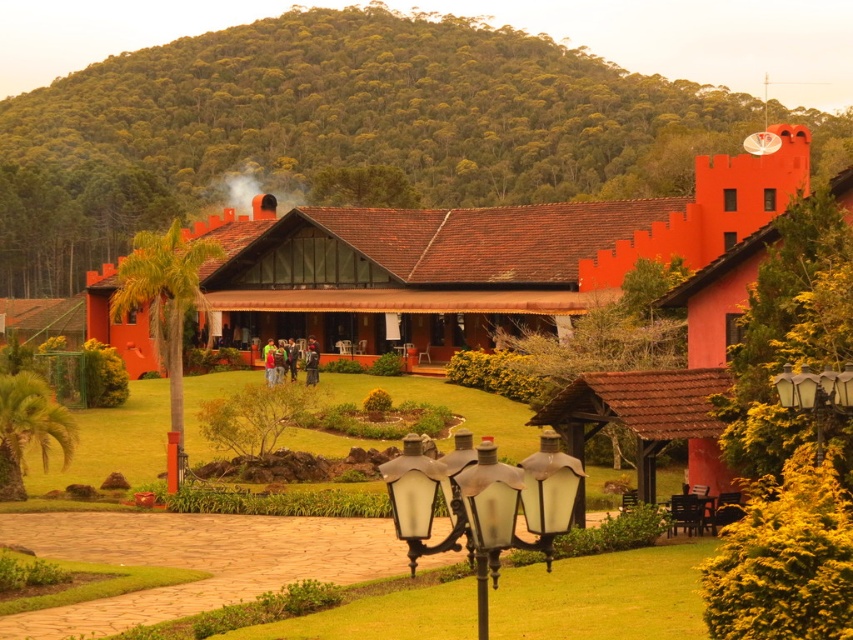
Can you confirm if green grass at center is thinner than matte glass lamp post at right?

Incorrect, green grass at center's width is not less than matte glass lamp post at right's.

Is green grass at center smaller than matte glass lamp post at right?

Answer: No.

You are a GUI agent. You are given a task and a screenshot of the screen. Output one action in this format:
    pyautogui.click(x=<x>, y=<y>)
    Task: Click on the green grass at center
    The width and height of the screenshot is (853, 640).
    Given the screenshot: What is the action you would take?
    pyautogui.click(x=113, y=442)

Between green leafy hillside at upper center and matte black lamp post at center, which one appears on the right side from the viewer's perspective?

Positioned to the right is matte black lamp post at center.

Is point (4, 172) closer to viewer compared to point (532, 531)?

That is False.

Between point (84, 160) and point (544, 532), which one is positioned in front?

Point (544, 532) is in front.

Where is `green leafy hillside at upper center`? The width and height of the screenshot is (853, 640). green leafy hillside at upper center is located at coordinates (335, 129).

Between green leafy hillside at upper center and matte glass lamp post at right, which one is positioned higher?

green leafy hillside at upper center is higher up.

Measure the distance from green leafy hillside at upper center to matte glass lamp post at right.

A distance of 152.93 meters exists between green leafy hillside at upper center and matte glass lamp post at right.

At what (x,y) coordinates should I click in order to perform the action: click on green leafy hillside at upper center. Please return your answer as a coordinate pair (x, y). Image resolution: width=853 pixels, height=640 pixels. Looking at the image, I should click on (335, 129).